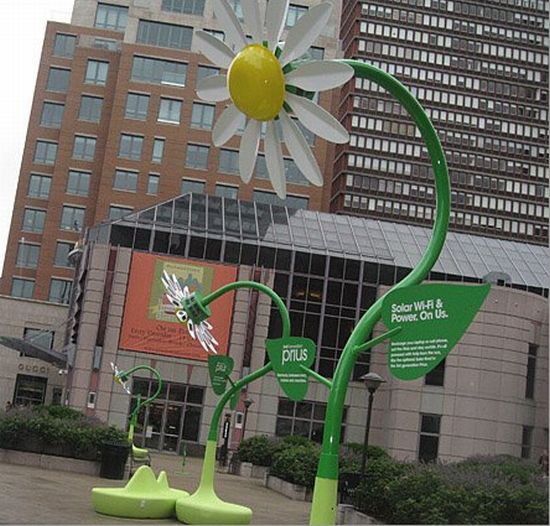
Image resolution: width=550 pixels, height=526 pixels. I want to click on door, so click(x=151, y=413), click(x=170, y=423).